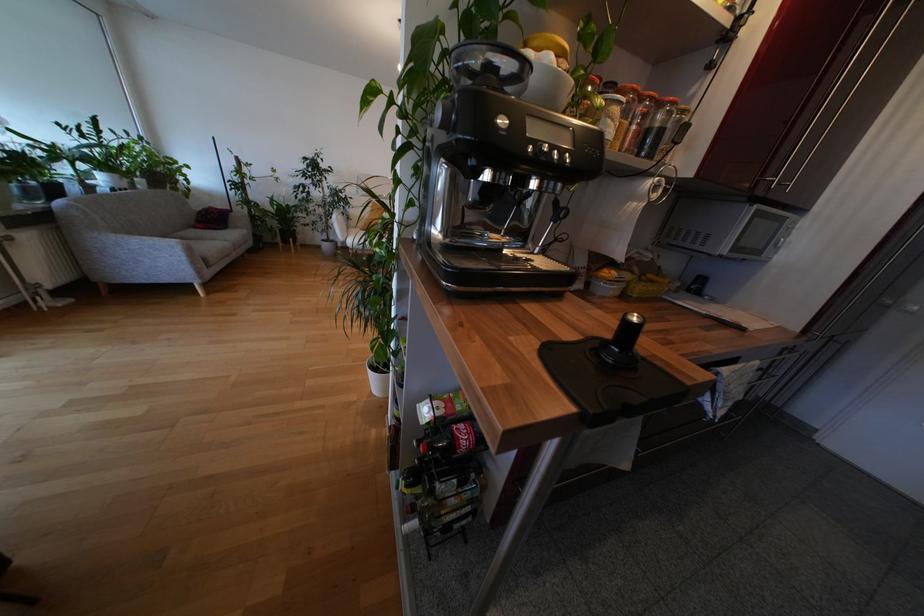
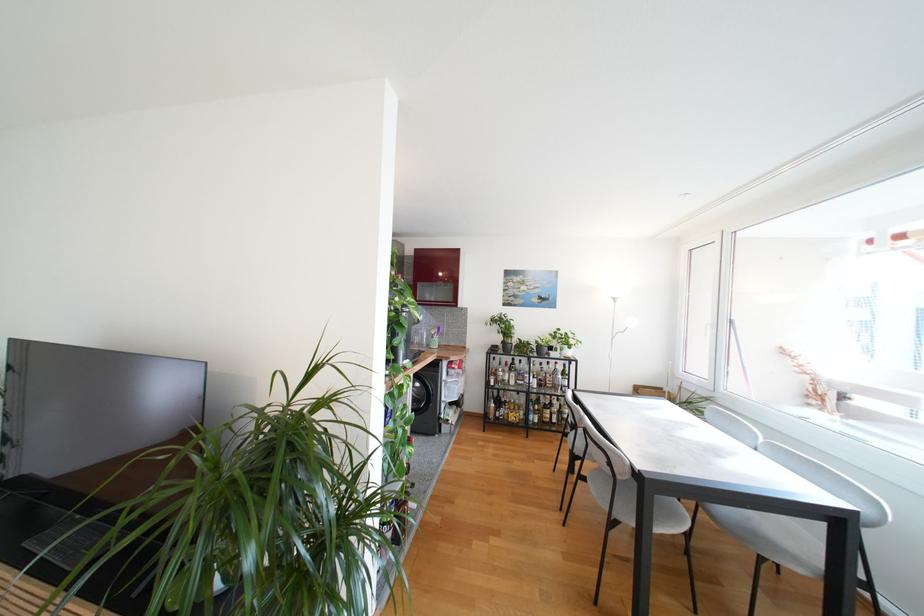
Question: I am providing you with two images of the same scene from different viewpoints. After the viewpoint changes to image2, which objects are now occluded?

Choices:
 (A) utensil holder
 (B) metal cabinet handle
 (C) white window handle
 (D) metal dispenser handle

Answer: (B)